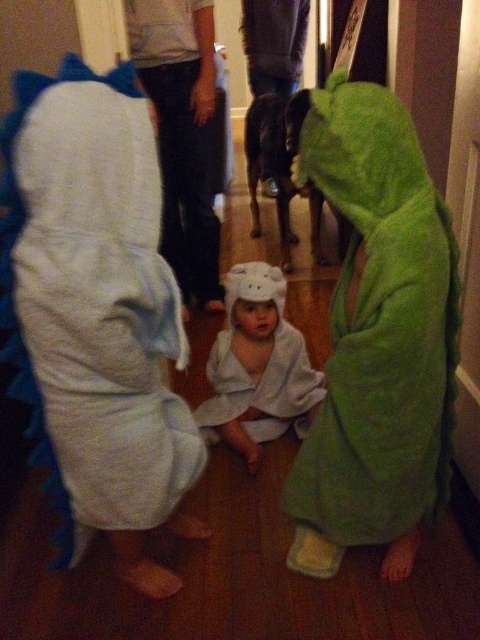
Question: Does green fuzzy bathrobe at right have a larger size compared to white towel at center?

Choices:
 (A) yes
 (B) no

Answer: (A)

Question: Can you confirm if white fluffy dress at left is positioned below white towel at center?

Choices:
 (A) yes
 (B) no

Answer: (B)

Question: Among these points, which one is nearest to the camera?

Choices:
 (A) (124, 109)
 (B) (445, 301)

Answer: (A)

Question: Which object is the farthest from the white towel at center?

Choices:
 (A) white fluffy dress at left
 (B) green fuzzy bathrobe at right

Answer: (A)

Question: Can you confirm if white fluffy dress at left is positioned to the left of green fuzzy bathrobe at right?

Choices:
 (A) yes
 (B) no

Answer: (A)

Question: Which of the following is the closest to the observer?

Choices:
 (A) white towel at center
 (B) green fuzzy bathrobe at right
 (C) white fluffy dress at left

Answer: (C)